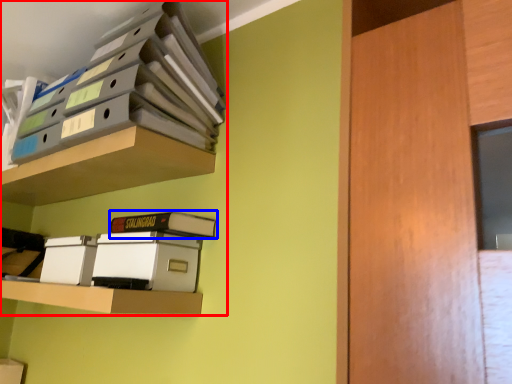
Question: Which of the following is the closest to the observer, shelf (highlighted by a red box) or paperback book (highlighted by a blue box)?

Choices:
 (A) shelf
 (B) paperback book

Answer: (A)